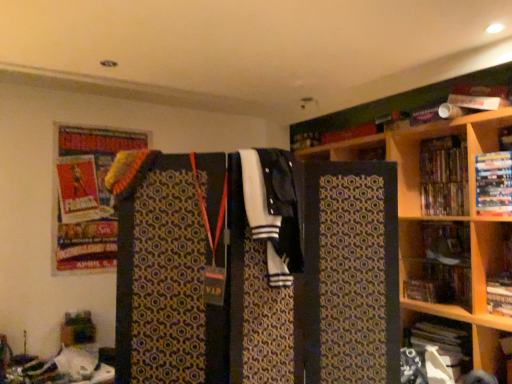
Question: Looking at the image, does hardcover book at upper right, the third book positioned from the bottom, seem bigger or smaller compared to white and black fabric at center?

Choices:
 (A) small
 (B) big

Answer: (A)

Question: Choose the correct answer: Is hardcover book at upper right, the third book positioned from the bottom, inside white and black fabric at center or outside it?

Choices:
 (A) inside
 (B) outside

Answer: (B)

Question: Which object is positioned farthest from the white paper at lower right, placed as the fourth book when sorted from top to bottom?

Choices:
 (A) wooden bookcase at right
 (B) white and black fabric at center
 (C) wooden bookshelf at right
 (D) hardcover book at upper right, which is the 1th book in top-to-bottom order
 (E) hardcover book at right, the 3th book positioned from the top

Answer: (B)

Question: Which of these objects is positioned farthest from the white and black fabric at center?

Choices:
 (A) wooden bookshelf at right
 (B) hardcover book at upper right, the third book positioned from the bottom
 (C) wooden bookcase at right
 (D) hardcover book at right, the 3th book positioned from the top
 (E) white paper at lower right, placed as the 1th book when sorted from bottom to top

Answer: (E)